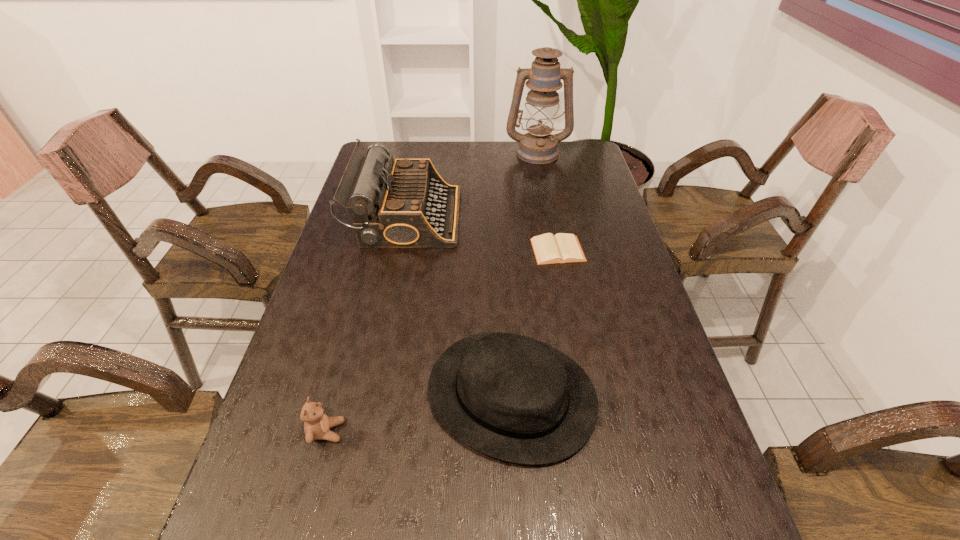
I want to click on free space between the shortest object and the teddy bear, so (443, 341).

The height and width of the screenshot is (540, 960). Identify the location of object that is the third nearest to the diary. (539, 146).

I want to click on object that is the closest to the fedora, so click(x=317, y=424).

At what (x,y) coordinates should I click in order to perform the action: click on free space that satisfies the following two spatial constraints: 1. on the keyboard of the shortest object; 2. on the right side of the second tallest object. Please return your answer as a coordinate pair (x, y). The image size is (960, 540). Looking at the image, I should click on (400, 250).

The image size is (960, 540). I want to click on vacant area in the image that satisfies the following two spatial constraints: 1. on the keyboard of the second tallest object; 2. on the right side of the diary, so click(x=400, y=250).

Where is `free location that satisfies the following two spatial constraints: 1. on the keyboard of the fedora; 2. on the left side of the typewriter`? This screenshot has height=540, width=960. free location that satisfies the following two spatial constraints: 1. on the keyboard of the fedora; 2. on the left side of the typewriter is located at coordinates (372, 394).

Locate an element on the screen. The height and width of the screenshot is (540, 960). vacant region that satisfies the following two spatial constraints: 1. on the back side of the diary; 2. on the keyboard of the second tallest object is located at coordinates (551, 217).